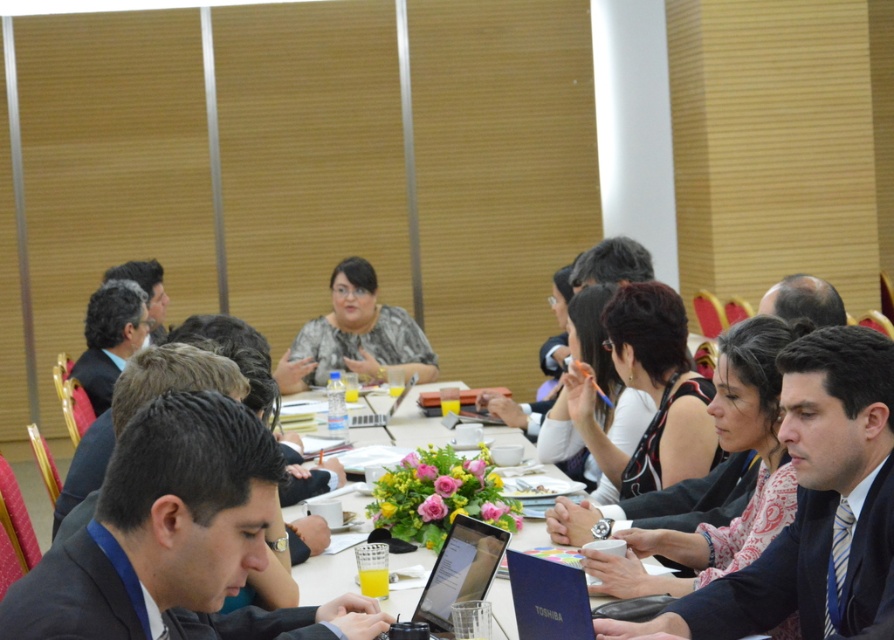
You are attending a meeting and need to hand a document to both the person in the dark gray suit at center and the person in the matte gray blouse at center. Which person should you approach first if you want to give the document to the closer individual first?

You should approach the dark gray suit at center first because they are closer to you than the matte gray blouse at center, according to the spatial description provided.

You are organizing a presentation and need to choose between the silver metallic laptop at center and the metallic silver laptop at center for your slide show. Based on their sizes, which one would you recommend for better visibility during the presentation?

The metallic silver laptop at center is larger than the silver metallic laptop at center, so it would be better for better visibility during the presentation.

You are a participant in the meeting and need to access your laptop. Which laptop should you reach for if you want the one closer to you? The silver metallic laptop at center or the metallic silver laptop at center?

The silver metallic laptop at center is closer to you because it is in front of the metallic silver laptop at center.